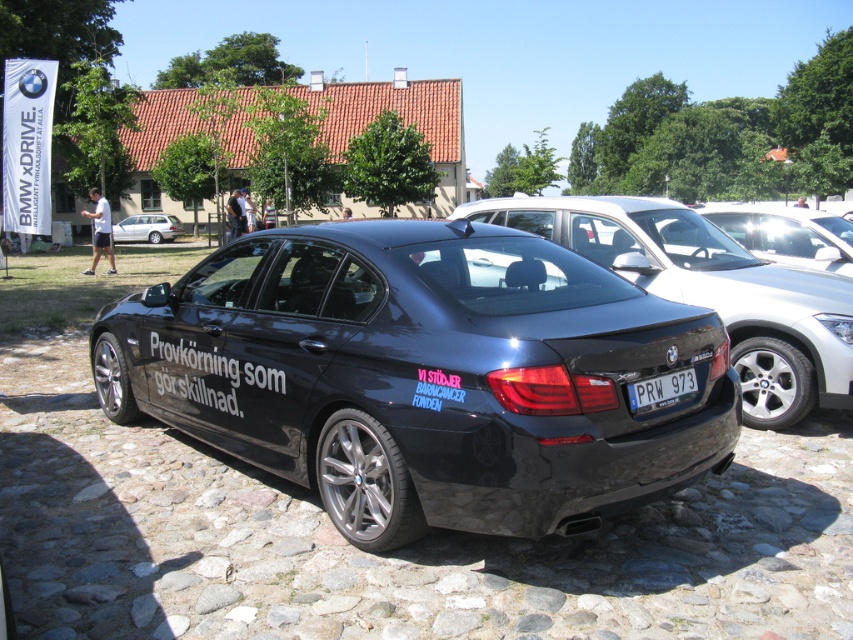
Is the position of glossy black car at center more distant than that of white plastic license plate at center?

Yes, it is behind white plastic license plate at center.

Can you confirm if glossy black car at center is wider than white plastic license plate at center?

No.

Where is `glossy black car at center`? Image resolution: width=853 pixels, height=640 pixels. glossy black car at center is located at coordinates (711, 291).

Which is behind, point (329, 330) or point (636, 227)?

Positioned behind is point (636, 227).

Is point (158, 298) closer to camera compared to point (706, 230)?

Yes, point (158, 298) is closer to viewer.

In order to click on glossy black sedan at center in this screenshot , I will do `click(424, 376)`.

Can you confirm if glossy black sedan at center is wider than white plastic license plate at center?

Yes, glossy black sedan at center is wider than white plastic license plate at center.

Is point (112, 401) positioned in front of point (694, 381)?

No, it is not.

Who is more distant from viewer, [415,225] or [679,390]?

The point [415,225] is more distant.

Locate an element on the screen. This screenshot has width=853, height=640. glossy black sedan at center is located at coordinates (424, 376).